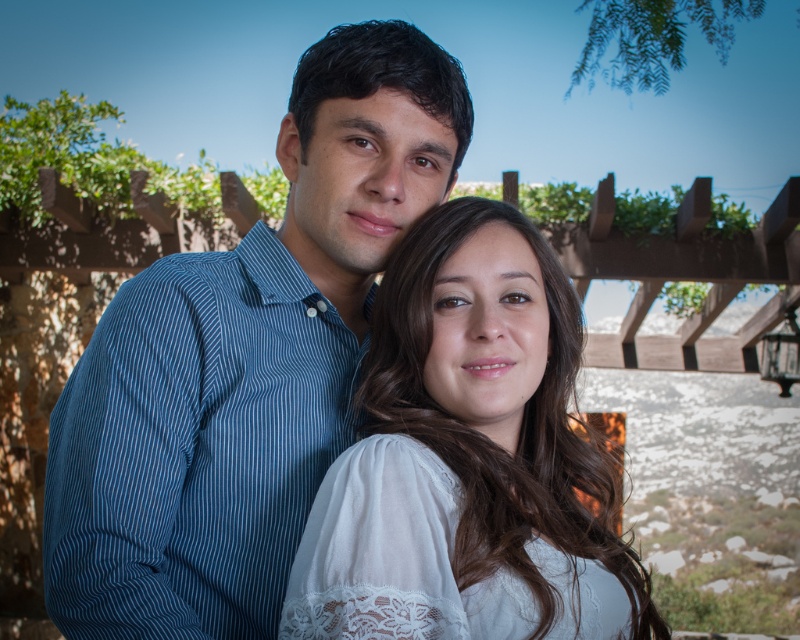
You are a photographer setting up for a portrait. You notice the blue striped shirt at center and the white lace blouse at center in your frame. Which clothing item is positioned higher in the image?

The blue striped shirt at center is above the white lace blouse at center, so it is positioned higher in the image.

You are a photographer standing at a certain distance from the blue striped shirt at center. You want to capture a closeup shot of the shirt without any distortion. The recommended minimum focusing distance for your camera lens is 36 inches. Can you take the photo as planned?

The blue striped shirt at center and viewer are 37.30 inches apart from each other. Since the minimum focusing distance is 36 inches, you can take the photo as planned because the distance is sufficient.

You are a photographer setting up for a group photo. You need to ensure that all subjects are visible in the frame. Given that the blue striped shirt at center and the white lace blouse at center are part of the group, which clothing item requires more space in the composition to maintain visibility?

The blue striped shirt at center requires more space in the composition because it has a larger size compared to the white lace blouse at center.